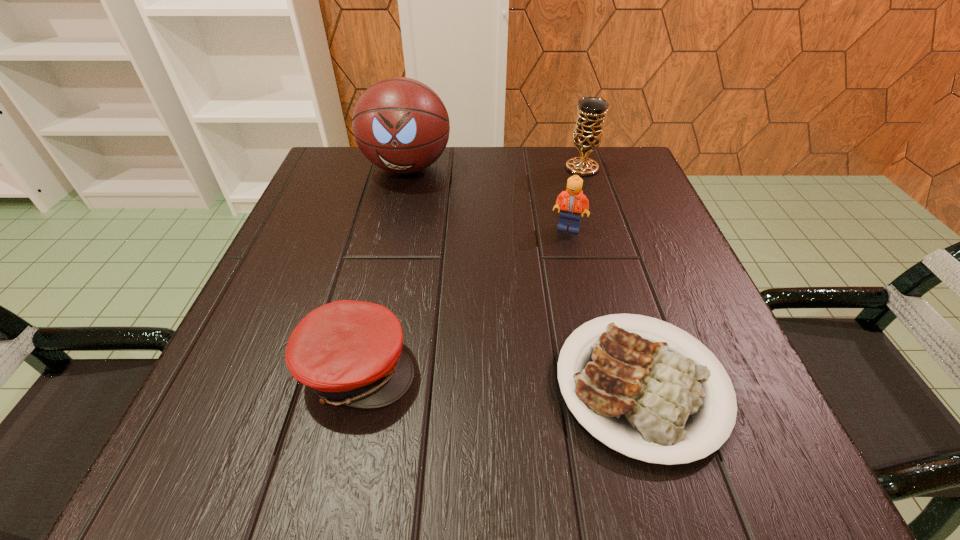
You are a GUI agent. You are given a task and a screenshot of the screen. Output one action in this format:
    pyautogui.click(x=<x>, y=<y>)
    Task: Click on the object located in the near right corner section of the desktop
    Image resolution: width=960 pixels, height=540 pixels.
    Given the screenshot: What is the action you would take?
    pyautogui.click(x=652, y=400)

The image size is (960, 540). Identify the location of blank area at the far edge. (461, 202).

In the image, there is a desktop. Identify the location of vacant space at the near edge. (400, 447).

The height and width of the screenshot is (540, 960). Identify the location of vacant point at the left edge. (309, 237).

You are a GUI agent. You are given a task and a screenshot of the screen. Output one action in this format:
    pyautogui.click(x=<x>, y=<y>)
    Task: Click on the vacant space at the right edge
    The image size is (960, 540).
    Given the screenshot: What is the action you would take?
    pyautogui.click(x=655, y=293)

The image size is (960, 540). I want to click on vacant region at the far left corner of the desktop, so click(381, 189).

Where is `free spot at the near right corner of the desktop`? free spot at the near right corner of the desktop is located at coordinates (784, 488).

I want to click on free point between the second shortest object and the basketball, so click(382, 268).

This screenshot has width=960, height=540. In order to click on free point between the third farthest object and the basketball in this screenshot , I will do `click(488, 198)`.

The height and width of the screenshot is (540, 960). In order to click on vacant space that's between the second shortest object and the shortest object in this screenshot , I will do `click(499, 377)`.